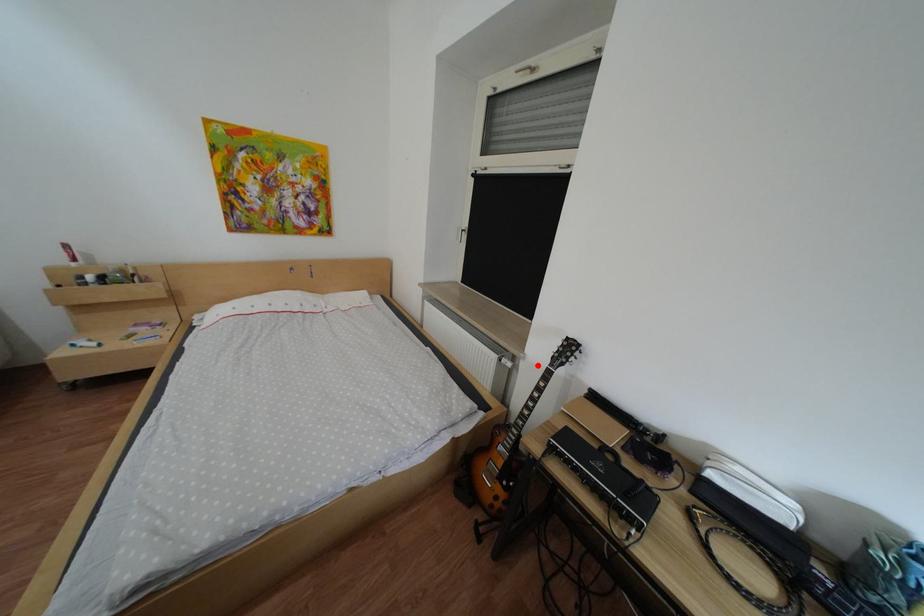
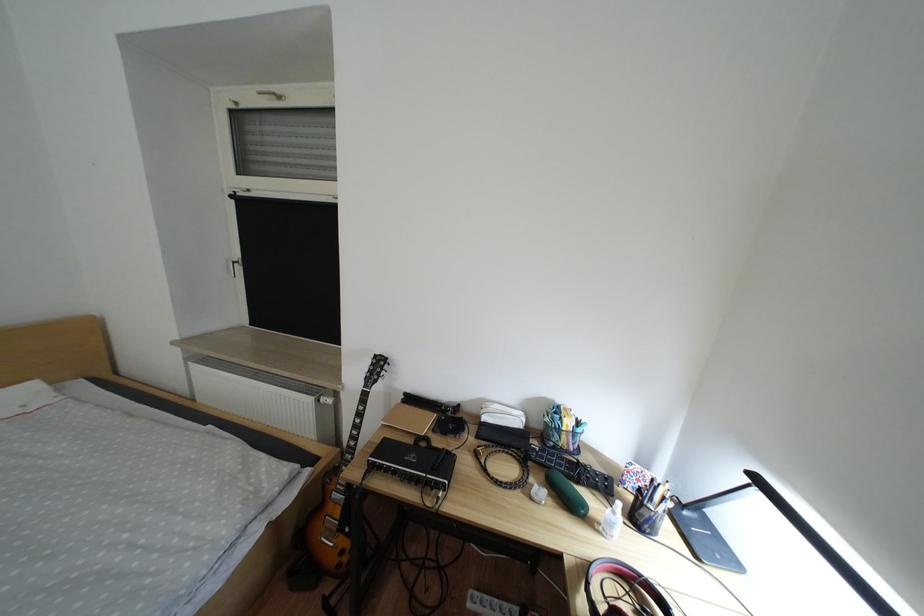
Locate, in the second image, the point that corresponds to the highlighted location in the first image.

(359, 397)